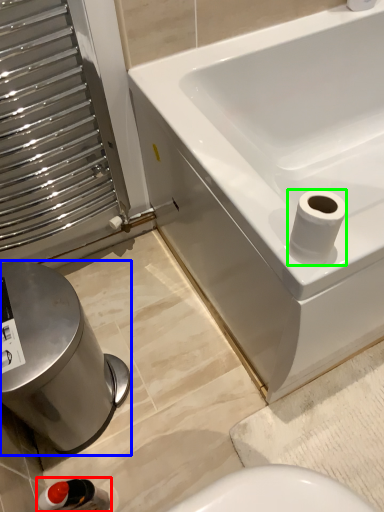
Question: Based on their relative distances, which object is nearer to plumbing fixture (highlighted by a red box)? Choose from bidet (highlighted by a blue box) and toilet paper (highlighted by a green box).

Choices:
 (A) bidet
 (B) toilet paper

Answer: (A)